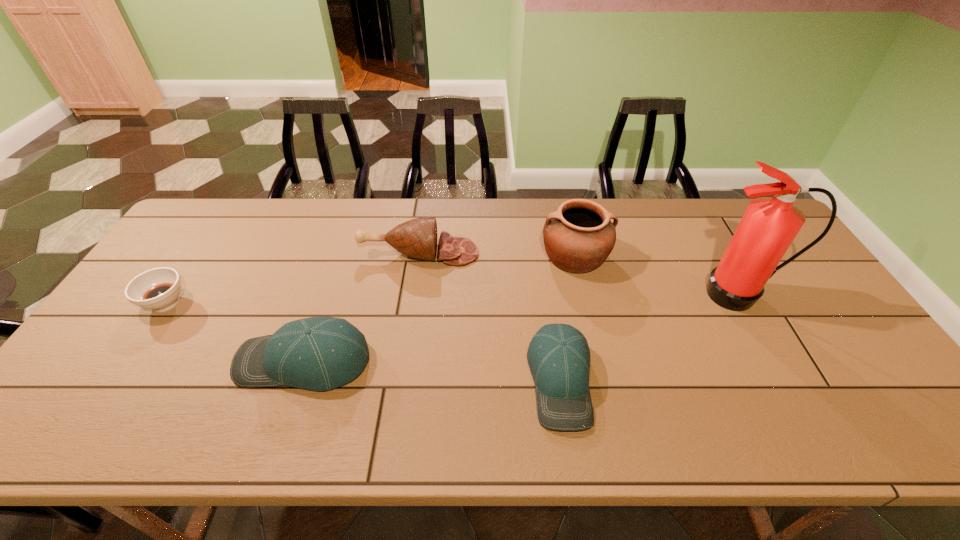
Given the evenly spaced baseball caps in the image, where should an extra baseball cap be added on the right to preserve the spacing? Please point to a vacant space. Please provide its 2D coordinates. Your answer should be formatted as a tuple, i.e. [(x, y)], where the tuple contains the x and y coordinates of a point satisfying the conditions above.

[(836, 400)]